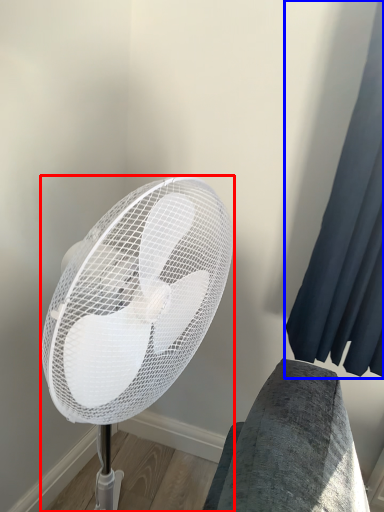
Question: Which object is further to the camera taking this photo, mechanical fan (highlighted by a red box) or curtain (highlighted by a blue box)?

Choices:
 (A) mechanical fan
 (B) curtain

Answer: (B)